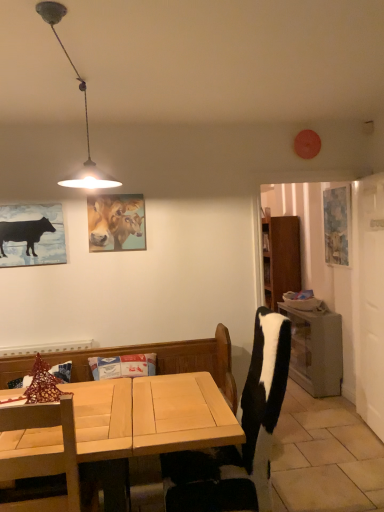
Image resolution: width=384 pixels, height=512 pixels. I want to click on blank area beneath metallic pendant light at upper left (from a real-world perspective), so click(99, 412).